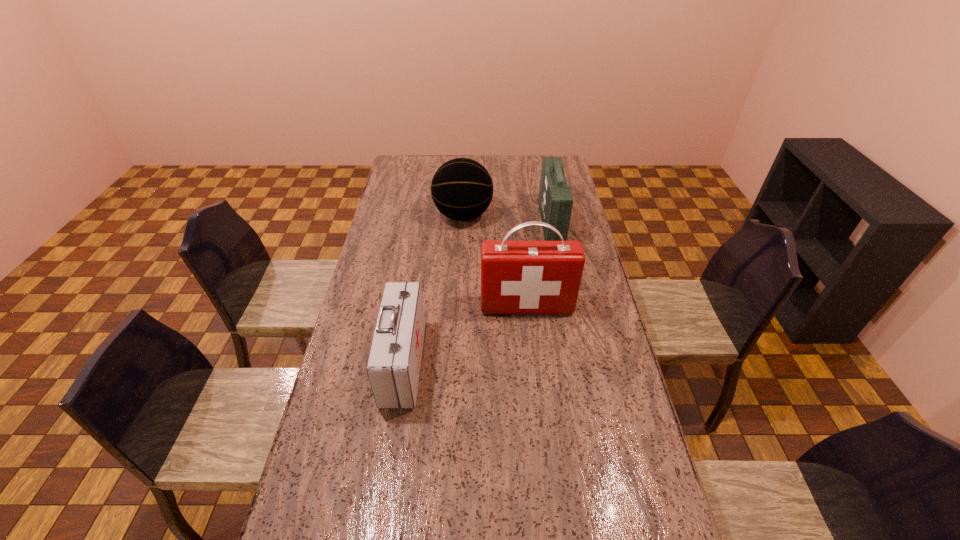
This screenshot has width=960, height=540. I want to click on the second nearest object, so click(x=517, y=277).

Locate an element on the screen. The image size is (960, 540). the second farthest first-aid kit is located at coordinates (517, 277).

You are a GUI agent. You are given a task and a screenshot of the screen. Output one action in this format:
    pyautogui.click(x=<x>, y=<y>)
    Task: Click on the basketball
    
    Given the screenshot: What is the action you would take?
    pyautogui.click(x=462, y=189)

At what (x,y) coordinates should I click in order to perform the action: click on the second shortest first-aid kit. Please return your answer as a coordinate pair (x, y). Looking at the image, I should click on (555, 200).

I want to click on the shortest object, so click(393, 367).

Image resolution: width=960 pixels, height=540 pixels. I want to click on the nearest object, so click(393, 367).

The image size is (960, 540). Identify the location of free space located on the front face of the tallest first-aid kit. (535, 382).

This screenshot has width=960, height=540. Find the location of `free location located 0.230m on the front of the basketball`. free location located 0.230m on the front of the basketball is located at coordinates (x=461, y=271).

I want to click on blank space located 0.270m on the front-facing side of the farthest first-aid kit, so click(479, 224).

Where is `vacant area situated 0.350m on the front-facing side of the farthest first-aid kit`? This screenshot has width=960, height=540. vacant area situated 0.350m on the front-facing side of the farthest first-aid kit is located at coordinates (460, 224).